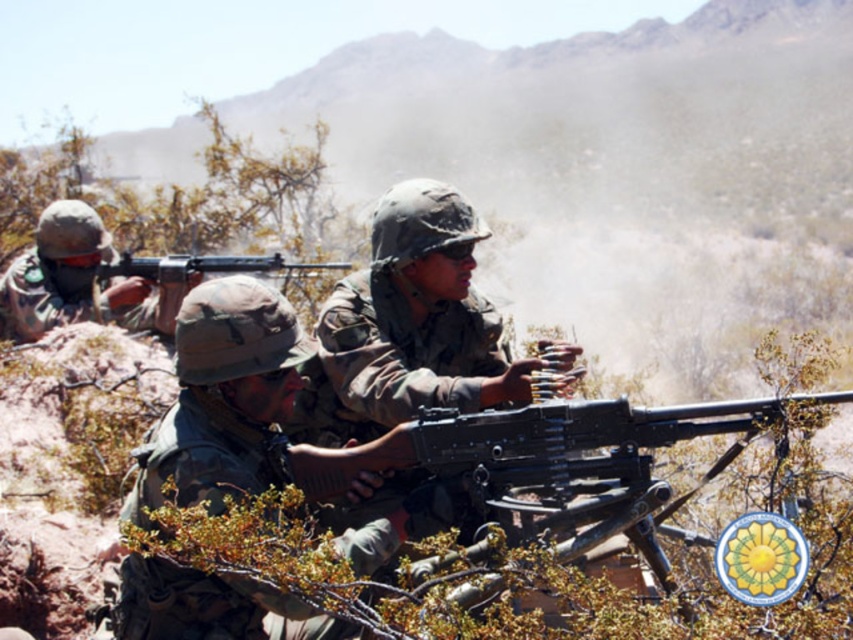
You are a soldier in the desert. You need to quickly identify the metallic black machine gun at center and the matte green helmet at left. Which object is located to the right of the other?

The metallic black machine gun at center is positioned on the right side of matte green helmet at left.

In the scene shown: You are a military analyst assessing the desert training exercise. You notice the matte green helmet at left and the matte black machine gun at center. Which object has a greater thickness when viewed from the front?

The matte black machine gun at center is thicker than the matte green helmet at left.

You are a drone operator observing the military training exercise in the desert. You need to locate the matte green helmet at left. What are the coordinates where you should direct the drone to hover above?

The coordinates for the matte green helmet at left are at point [78,280].